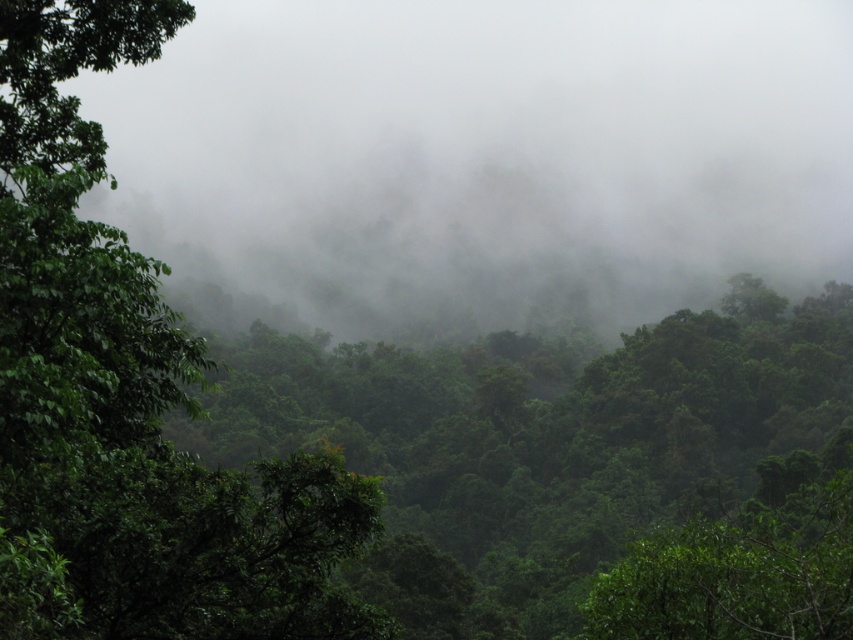
Looking at this image, between white misty fog at upper center and green leafy tree at left, which one has less height?

With less height is green leafy tree at left.

Which is behind, point (724, 42) or point (119, 602)?

The point (724, 42) is behind.

The image size is (853, 640). I want to click on white misty fog at upper center, so click(486, 156).

Identify the location of white misty fog at upper center. (486, 156).